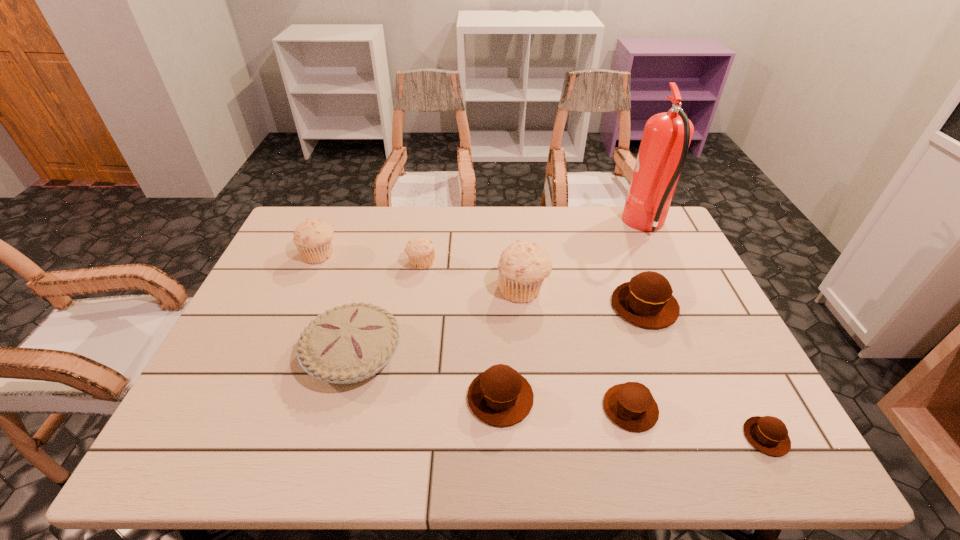
This screenshot has width=960, height=540. In order to click on the tallest object in this screenshot , I will do `click(666, 138)`.

Locate an element on the screen. fire extinguisher is located at coordinates (666, 138).

This screenshot has width=960, height=540. Identify the location of the biggest beige muffin. (522, 267).

Find the location of a particular element. Image resolution: width=960 pixels, height=540 pixels. the second tallest object is located at coordinates (522, 267).

Identify the location of the leftmost beige muffin. (313, 238).

Where is `the leftmost muffin`? the leftmost muffin is located at coordinates (313, 238).

Locate an element on the screen. This screenshot has height=540, width=960. the biggest brown muffin is located at coordinates (646, 301).

Find the location of a particular element. the second beige muffin from left to right is located at coordinates (420, 250).

Find the location of `the sixth muffin from right to left`. the sixth muffin from right to left is located at coordinates (420, 250).

Where is `pie`? The width and height of the screenshot is (960, 540). pie is located at coordinates (350, 343).